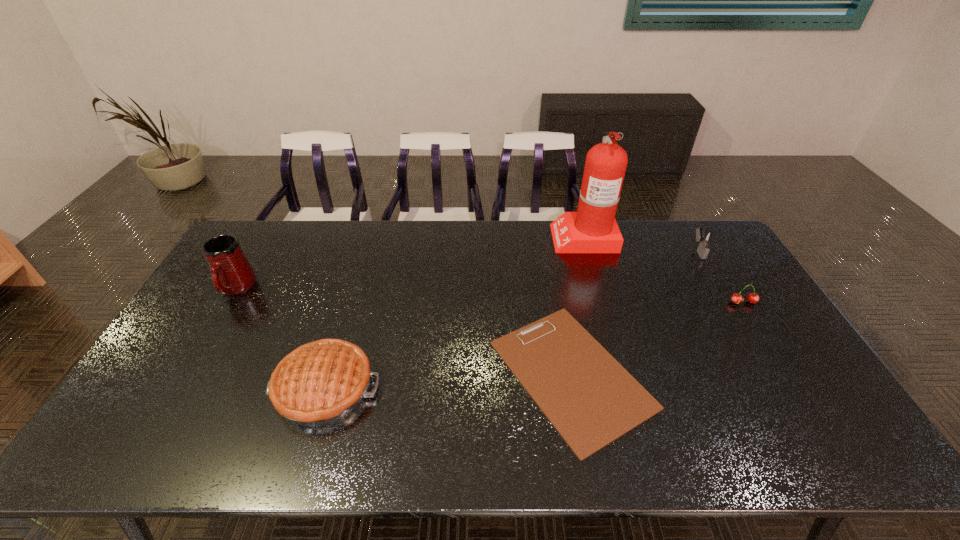
Find the location of `igniter positioned at the right edge`. igniter positioned at the right edge is located at coordinates (705, 238).

At what (x,y) coordinates should I click in order to perform the action: click on cherry present at the right edge. Please return your answer as a coordinate pair (x, y). This screenshot has height=540, width=960. Looking at the image, I should click on (736, 298).

Locate an element on the screen. object present at the far right corner is located at coordinates (705, 238).

This screenshot has height=540, width=960. What are the coordinates of `vacant space at the far edge` in the screenshot? It's located at (491, 254).

Where is `free region at the near edge of the desktop`? This screenshot has width=960, height=540. free region at the near edge of the desktop is located at coordinates pos(486,427).

Identify the location of vacant space at the left edge. Image resolution: width=960 pixels, height=540 pixels. (177, 334).

You are a GUI agent. You are given a task and a screenshot of the screen. Output one action in this format:
    pyautogui.click(x=<x>, y=<y>)
    Task: Click on the vacant space at the right edge of the desktop
    The height and width of the screenshot is (540, 960).
    Given the screenshot: What is the action you would take?
    pyautogui.click(x=749, y=307)

At what (x,y) coordinates should I click in order to perform the action: click on vacant space at the far left corner of the desktop. Please return your answer as a coordinate pair (x, y). Looking at the image, I should click on (277, 248).

Where is `free space at the near right corner`? This screenshot has height=540, width=960. free space at the near right corner is located at coordinates (821, 446).

Image resolution: width=960 pixels, height=540 pixels. I want to click on free spot between the clipboard and the fire extinguisher, so click(577, 305).